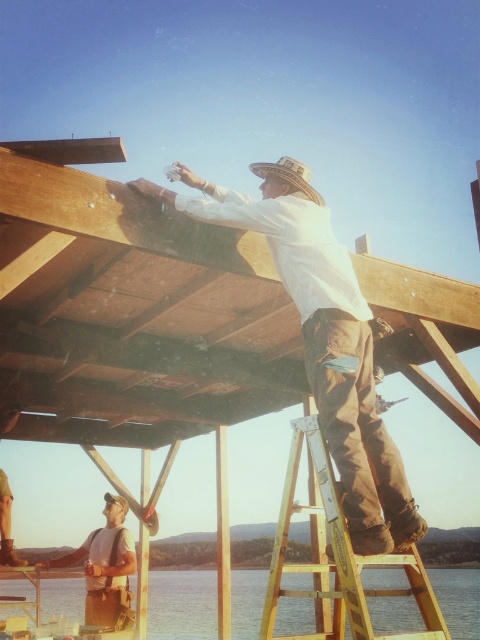
You are a photographer trying to capture a clear photo of the white cotton shirt at upper center and the rustic straw cowboy hat at upper center. Since both are in focus, which object will appear bigger in your photo?

The white cotton shirt at upper center will appear bigger in the photo because it is larger in size than the rustic straw cowboy hat at upper center.

You are a drone operator trying to capture aerial footage of the construction site. You have two points marked on your map, point (323, 388) and point (288, 161). Which point should you prioritize for a closer shot to ensure the construction worker on the yellow ladder is visible?

Point (323, 388) should be prioritized because it is closer to the camera, making it easier to capture a clear view of the construction worker on the yellow ladder.

You are a construction worker who needs to reach a tool placed on the wooden ladder at center. You are currently standing at the position of the white cotton shirt at upper center. Can you safely reach the tool without moving from your current position?

The white cotton shirt at upper center is 1.02 meters away from the wooden ladder at center. Since the average human arm length is about 0.7 meters, you cannot safely reach the tool placed on the wooden ladder at center from your current position without moving closer.